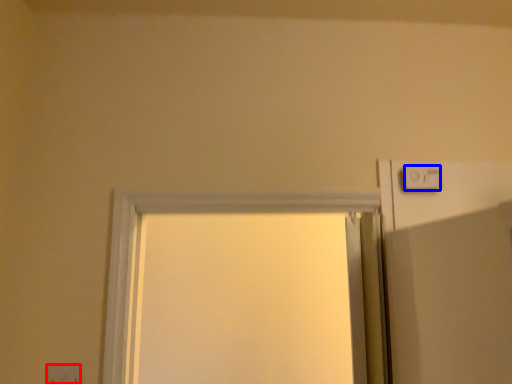
Question: Which point is closer to the camera, electric outlet (highlighted by a red box) or light switch (highlighted by a blue box)?

Choices:
 (A) electric outlet
 (B) light switch

Answer: (A)